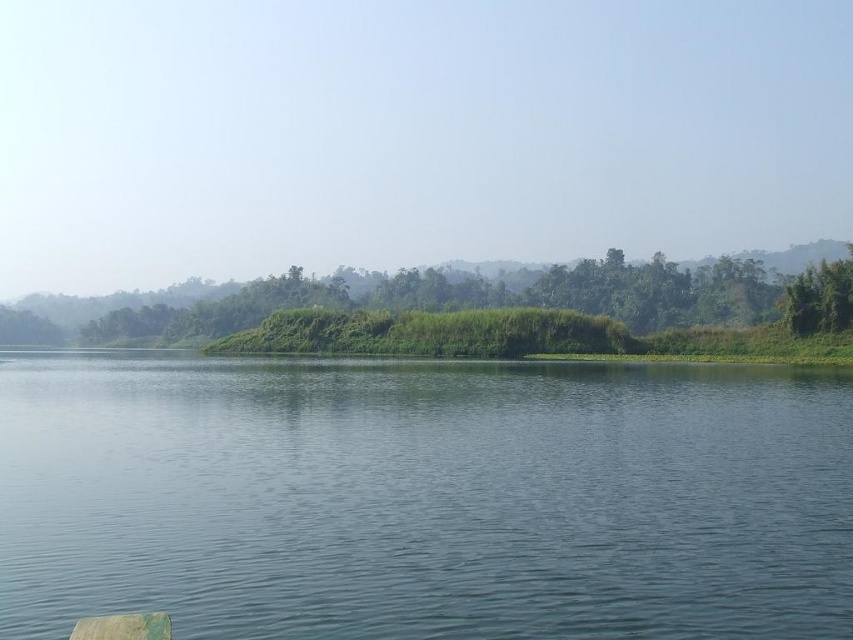
Can you confirm if blue smooth water at center is shorter than green leafy tree at right?

Yes.

Is blue smooth water at center to the left of green leafy tree at right from the viewer's perspective?

Yes, blue smooth water at center is to the left of green leafy tree at right.

The image size is (853, 640). Describe the element at coordinates (424, 497) in the screenshot. I see `blue smooth water at center` at that location.

This screenshot has width=853, height=640. I want to click on blue smooth water at center, so click(x=424, y=497).

Find the location of a particular element. This screenshot has width=853, height=640. green grassy mound at center is located at coordinates (431, 296).

Is point (462, 266) closer to camera compared to point (792, 285)?

No, (462, 266) is behind (792, 285).

Between point (343, 280) and point (820, 284), which one is positioned in front?

Point (820, 284) is in front.

Where is `green grassy mound at center`? green grassy mound at center is located at coordinates (431, 296).

Which is above, blue smooth water at center or green grassy mound at center?

Positioned higher is green grassy mound at center.

Between blue smooth water at center and green grassy mound at center, which one appears on the left side from the viewer's perspective?

From the viewer's perspective, green grassy mound at center appears more on the left side.

Is point (48, 449) farther from viewer compared to point (631, 292)?

No, it is not.

Find the location of a particular element. This screenshot has width=853, height=640. blue smooth water at center is located at coordinates (424, 497).